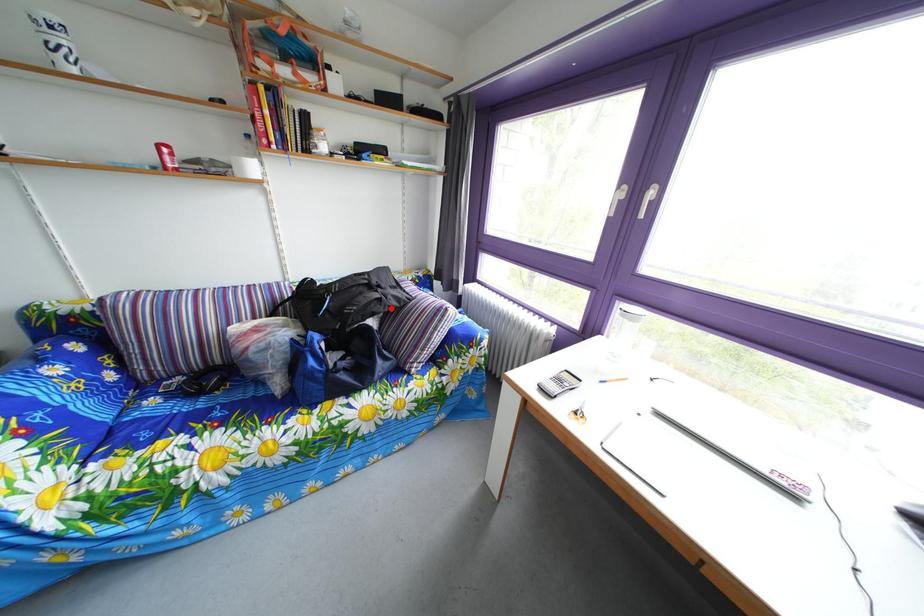
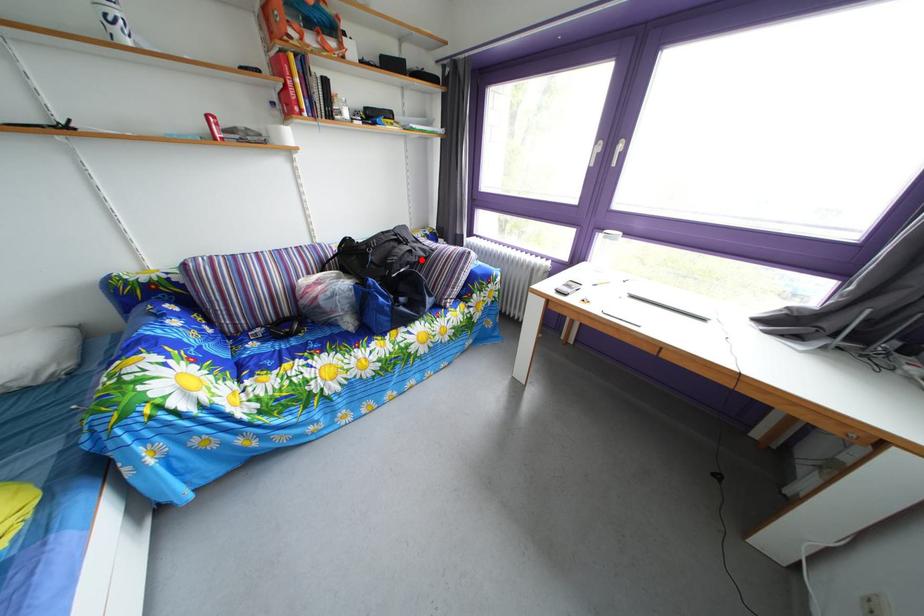
I am providing you with two images of the same scene from different viewpoints. A red point is marked on the first image and another point is marked on the second image. Are the points marked in image1 and image2 representing the same 3D position?

Yes